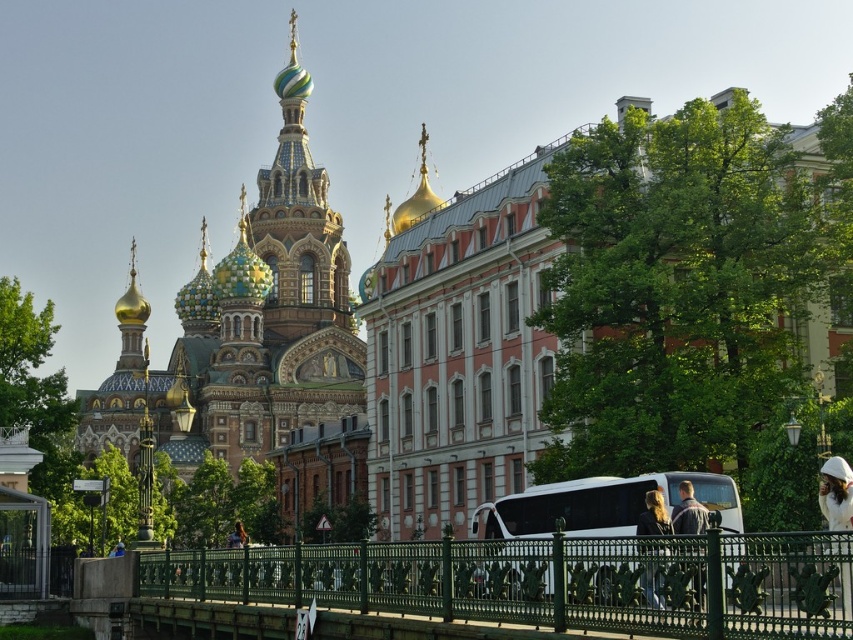
Is multicolored mosaic dome at upper left above green wrought iron bridge at center?

Indeed, multicolored mosaic dome at upper left is positioned over green wrought iron bridge at center.

Does multicolored mosaic dome at upper left appear on the right side of green wrought iron bridge at center?

In fact, multicolored mosaic dome at upper left is to the left of green wrought iron bridge at center.

Between point (126, 308) and point (779, 588), which one is positioned behind?

The point (126, 308) is behind.

The height and width of the screenshot is (640, 853). Find the location of `multicolored mosaic dome at upper left`. multicolored mosaic dome at upper left is located at coordinates (248, 340).

Can you confirm if multicolored mosaic dome at upper left is positioned below white glossy tour bus at center?

Actually, multicolored mosaic dome at upper left is above white glossy tour bus at center.

Locate an element on the screen. multicolored mosaic dome at upper left is located at coordinates (248, 340).

Image resolution: width=853 pixels, height=640 pixels. What do you see at coordinates (541, 580) in the screenshot?
I see `green wrought iron bridge at center` at bounding box center [541, 580].

Between point (651, 628) and point (699, 600), which one is positioned in front?

Point (651, 628)

Image resolution: width=853 pixels, height=640 pixels. What are the coordinates of `green wrought iron bridge at center` in the screenshot? It's located at (541, 580).